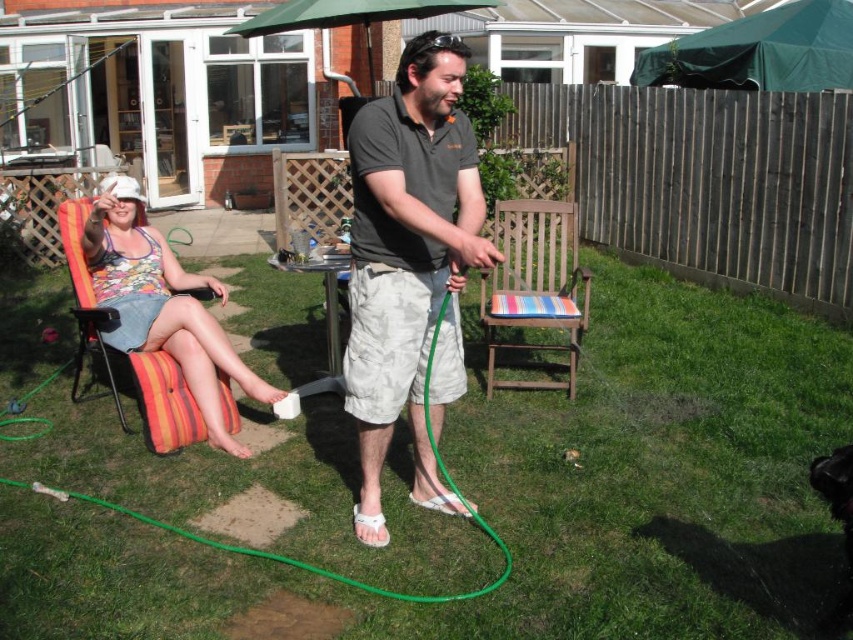
Question: Which point is closer to the camera?

Choices:
 (A) (144, 410)
 (B) (494, 534)
 (C) (439, 342)
 (D) (572, 260)

Answer: (B)

Question: Is the position of striped fabric chair at center less distant than that of striped fabric chair at left?

Choices:
 (A) yes
 (B) no

Answer: (B)

Question: Which point is closer to the camera taking this photo?

Choices:
 (A) (474, 515)
 (B) (383, 355)

Answer: (B)

Question: Based on their relative distances, which object is farther from the green rubber hose at lower left?

Choices:
 (A) striped fabric chair at left
 (B) striped fabric chair at center
 (C) dark gray cotton shirt at center

Answer: (B)

Question: Can you confirm if striped fabric chair at center is positioned below green rubber hose at lower left?

Choices:
 (A) no
 (B) yes

Answer: (A)

Question: Can you confirm if striped fabric chair at center is thinner than green rubber hose at lower left?

Choices:
 (A) no
 (B) yes

Answer: (B)